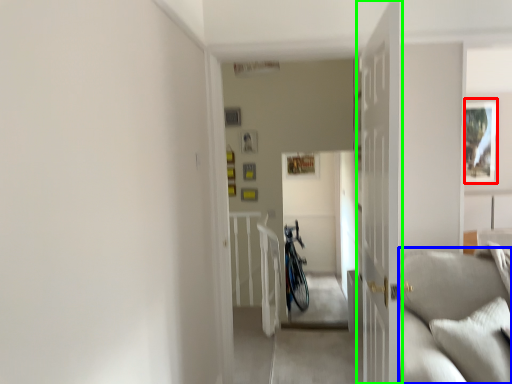
Question: Which object is positioned closest to picture frame (highlighted by a red box)? Select from couch (highlighted by a blue box) and door (highlighted by a green box).

Choices:
 (A) couch
 (B) door

Answer: (A)